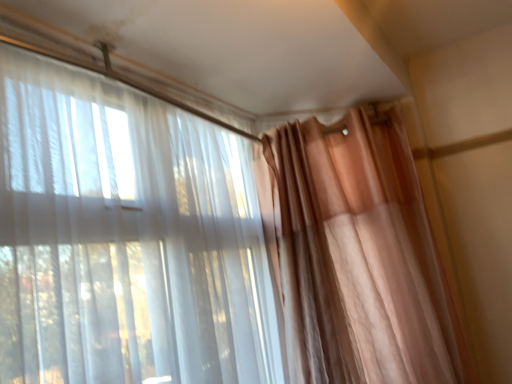
Question: Considering the positions of sheer white curtain at left, the 1th curtain from the left, and matte peach curtain at right, positioned as the 2th curtain in left-to-right order, in the image, is sheer white curtain at left, the 1th curtain from the left, wider or thinner than matte peach curtain at right, positioned as the 2th curtain in left-to-right order,?

Choices:
 (A) wide
 (B) thin

Answer: (B)

Question: In the image, is sheer white curtain at left, the 1th curtain from the left, on the left side or the right side of matte peach curtain at right, positioned as the 1th curtain in right-to-left order?

Choices:
 (A) left
 (B) right

Answer: (A)

Question: From the image's perspective, is sheer white curtain at left, the 1th curtain from the left, positioned above or below matte peach curtain at right, positioned as the 2th curtain in left-to-right order?

Choices:
 (A) above
 (B) below

Answer: (A)

Question: Relative to sheer white curtain at left, which ranks as the 2th curtain in right-to-left order, is matte peach curtain at right, positioned as the 1th curtain in right-to-left order, in front or behind?

Choices:
 (A) front
 (B) behind

Answer: (B)

Question: Considering the positions of matte peach curtain at right, positioned as the 2th curtain in left-to-right order, and sheer white curtain at left, the 1th curtain from the left, in the image, is matte peach curtain at right, positioned as the 2th curtain in left-to-right order, taller or shorter than sheer white curtain at left, the 1th curtain from the left,?

Choices:
 (A) short
 (B) tall

Answer: (B)

Question: Would you say matte peach curtain at right, positioned as the 1th curtain in right-to-left order, is inside or outside sheer white curtain at left, which ranks as the 2th curtain in right-to-left order?

Choices:
 (A) outside
 (B) inside

Answer: (A)

Question: From a real-world perspective, is matte peach curtain at right, positioned as the 2th curtain in left-to-right order, physically located above or below sheer white curtain at left, which ranks as the 2th curtain in right-to-left order?

Choices:
 (A) above
 (B) below

Answer: (B)